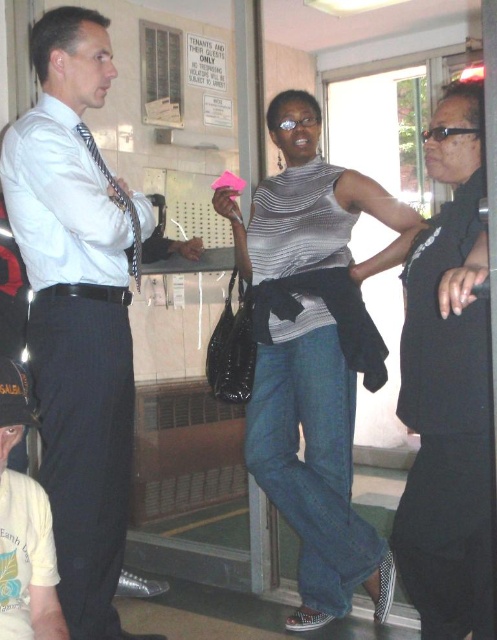
Question: Which object appears closest to the camera in this image?

Choices:
 (A) matte white shirt at center
 (B) striped jersey at center

Answer: (A)

Question: Which object is positioned closest to the white cotton t-shirt at lower left?

Choices:
 (A) matte white shirt at center
 (B) striped jersey at center
 (C) black matte vest at right

Answer: (A)

Question: Is black matte vest at right smaller than white cotton t-shirt at lower left?

Choices:
 (A) yes
 (B) no

Answer: (B)

Question: Is matte white shirt at center closer to the viewer compared to striped jersey at center?

Choices:
 (A) no
 (B) yes

Answer: (B)

Question: Which of the following is the closest to the observer?

Choices:
 (A) (6, 378)
 (B) (478, 385)
 (C) (128, 324)

Answer: (B)

Question: Does striped jersey at center have a larger size compared to black matte vest at right?

Choices:
 (A) no
 (B) yes

Answer: (B)